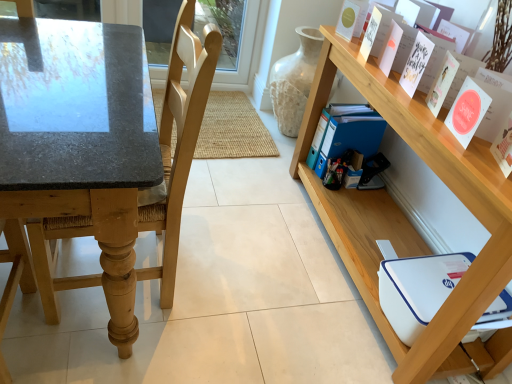
Question: Are blue plastic folder at center-right, the first paperback book viewed from the back, and wooden shelf at upper right beside each other?

Choices:
 (A) yes
 (B) no

Answer: (B)

Question: Is the depth of blue plastic folder at center-right, which appears as the sixth paperback book when viewed from the front, greater than that of wooden shelf at upper right?

Choices:
 (A) no
 (B) yes

Answer: (B)

Question: From the image's perspective, is blue plastic folder at center-right, which appears as the sixth paperback book when viewed from the front, beneath wooden shelf at upper right?

Choices:
 (A) yes
 (B) no

Answer: (B)

Question: Is blue plastic folder at center-right, which appears as the sixth paperback book when viewed from the front, far away from wooden shelf at upper right?

Choices:
 (A) yes
 (B) no

Answer: (B)

Question: Is blue plastic folder at center-right, the first paperback book viewed from the back, closer to the viewer compared to wooden shelf at upper right?

Choices:
 (A) no
 (B) yes

Answer: (A)

Question: Is wooden shelf at upper right inside the boundaries of light wood chair at left, or outside?

Choices:
 (A) outside
 (B) inside

Answer: (A)

Question: Relative to light wood chair at left, is wooden shelf at upper right in front or behind?

Choices:
 (A) behind
 (B) front

Answer: (A)

Question: From the image's perspective, is wooden shelf at upper right positioned above or below light wood chair at left?

Choices:
 (A) below
 (B) above

Answer: (A)

Question: From their relative heights in the image, would you say wooden shelf at upper right is taller or shorter than light wood chair at left?

Choices:
 (A) tall
 (B) short

Answer: (B)

Question: In terms of size, does white paper card at upper right appear bigger or smaller than wooden shelf at upper right?

Choices:
 (A) big
 (B) small

Answer: (B)

Question: From the image's perspective, is white paper card at upper right above or below wooden shelf at upper right?

Choices:
 (A) above
 (B) below

Answer: (A)

Question: Visually, is white paper card at upper right positioned to the left or to the right of wooden shelf at upper right?

Choices:
 (A) left
 (B) right

Answer: (B)

Question: Considering the positions of point (375, 23) and point (417, 342), is point (375, 23) closer or farther from the camera than point (417, 342)?

Choices:
 (A) closer
 (B) farther

Answer: (B)

Question: From the image's perspective, is wooden shelf at upper right above or below white matte paper at upper right, marked as the 6th paperback book in a back-to-front arrangement?

Choices:
 (A) above
 (B) below

Answer: (B)

Question: Would you say wooden shelf at upper right is to the left or to the right of white matte paper at upper right, marked as the 6th paperback book in a back-to-front arrangement, in the picture?

Choices:
 (A) left
 (B) right

Answer: (A)